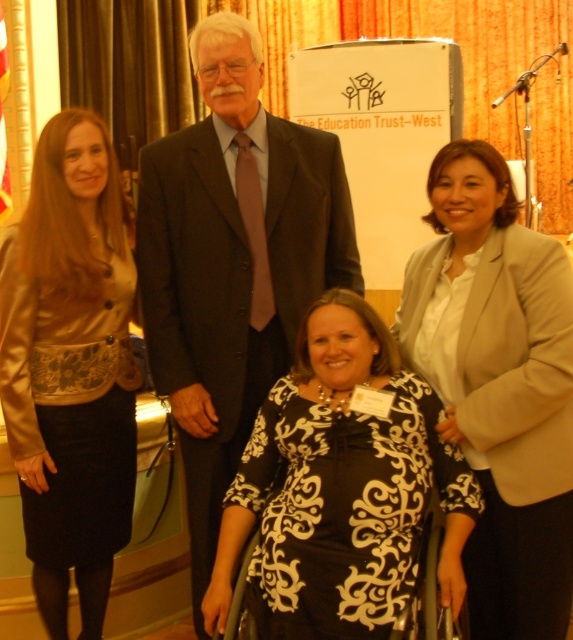
Question: Can you confirm if black printed dress at center is positioned to the left of beige satin blazer at right?

Choices:
 (A) no
 (B) yes

Answer: (B)

Question: Can you confirm if dark gray suit at center is positioned to the right of satin gold jacket at left?

Choices:
 (A) yes
 (B) no

Answer: (A)

Question: Which of the following is the farthest from the observer?

Choices:
 (A) (462, 305)
 (B) (23, 388)
 (C) (229, 234)
 (D) (284, 541)

Answer: (C)

Question: Among these objects, which one is nearest to the camera?

Choices:
 (A) dark gray suit at center
 (B) metallic silver wheelchair at center
 (C) black printed dress at center

Answer: (C)

Question: Is dark gray suit at center to the right of beige satin blazer at right from the viewer's perspective?

Choices:
 (A) no
 (B) yes

Answer: (A)

Question: Which point is farther from the camera taking this photo?

Choices:
 (A) (496, 365)
 (B) (237, 552)

Answer: (A)